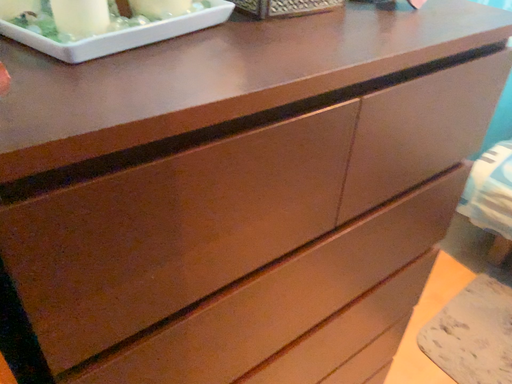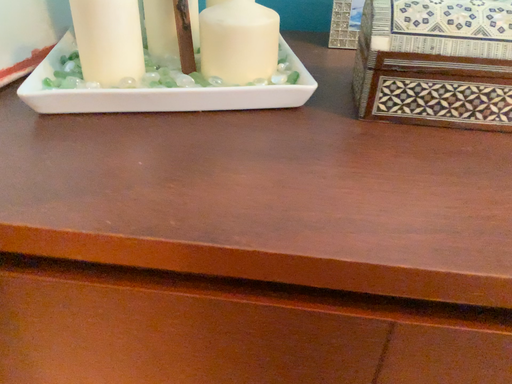
Question: Which way did the camera rotate in the video?

Choices:
 (A) rotated left
 (B) rotated right

Answer: (A)